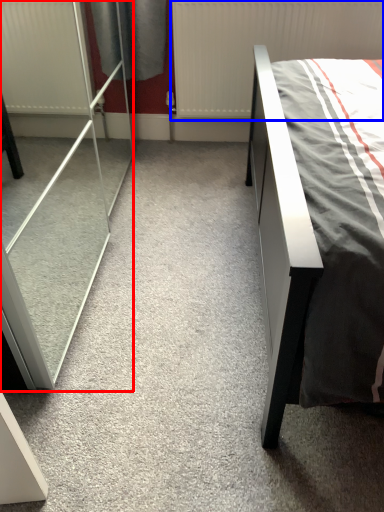
Question: Among these objects, which one is nearest to the camera, screen door (highlighted by a red box) or radiator (highlighted by a blue box)?

Choices:
 (A) screen door
 (B) radiator

Answer: (A)